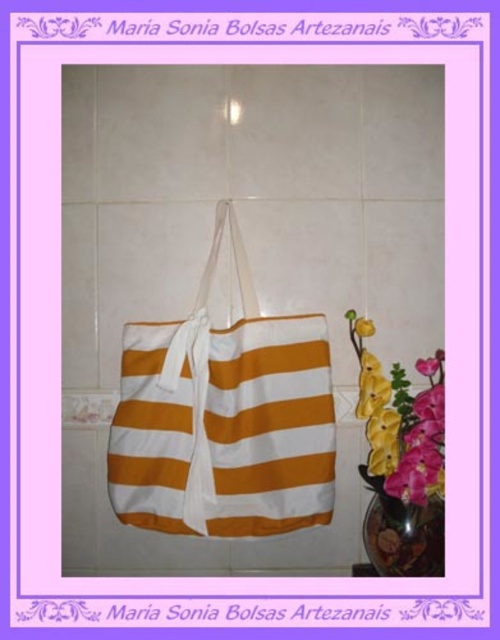
Does white cotton tote at center appear on the left side of yellow fabric flower at right?

Correct, you'll find white cotton tote at center to the left of yellow fabric flower at right.

Does white cotton tote at center come behind yellow fabric flower at right?

No, white cotton tote at center is in front of yellow fabric flower at right.

Measure the distance between white cotton tote at center and camera.

They are 83.85 centimeters apart.

Locate an element on the screen. white cotton tote at center is located at coordinates (224, 417).